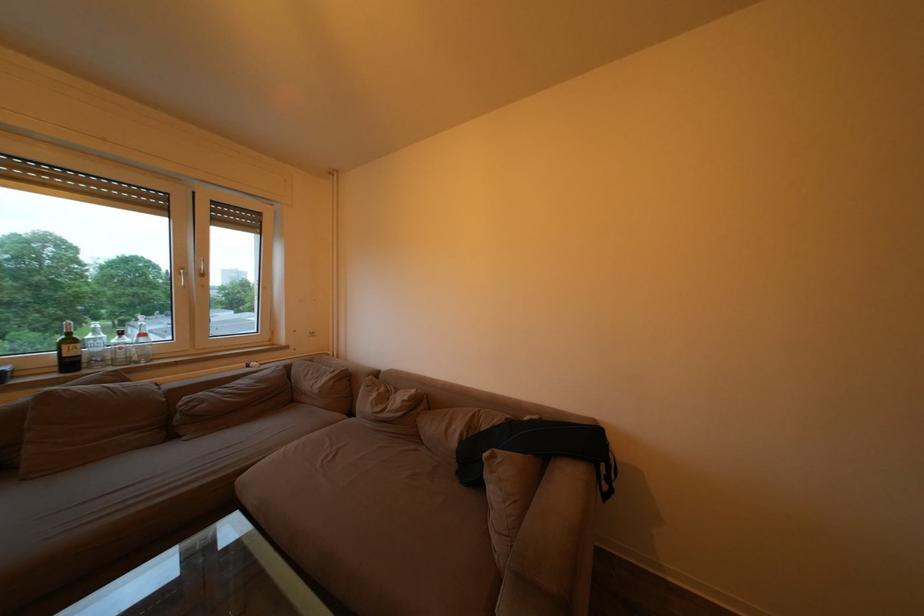
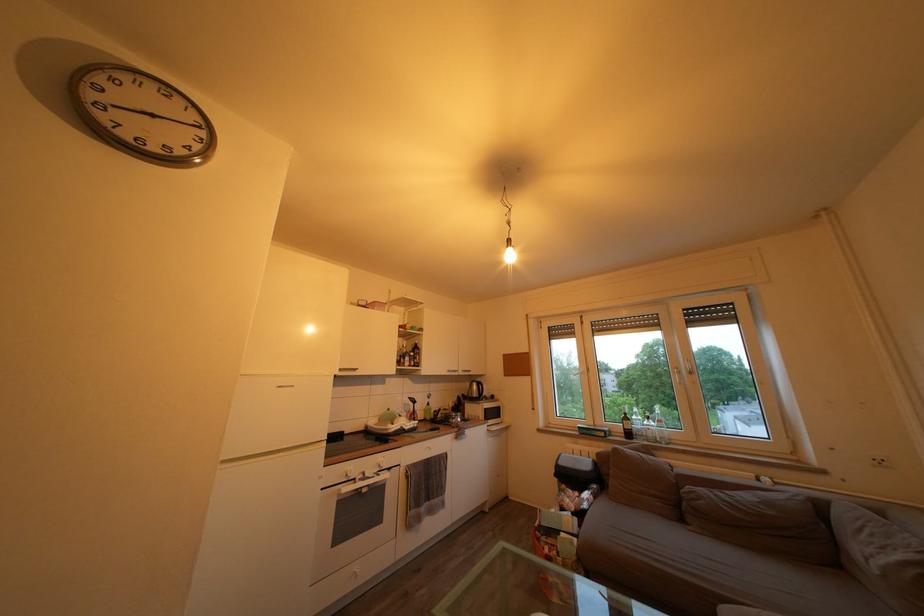
Where in the second image is the point corresponding to pixel 268 387 from the first image?

(774, 509)